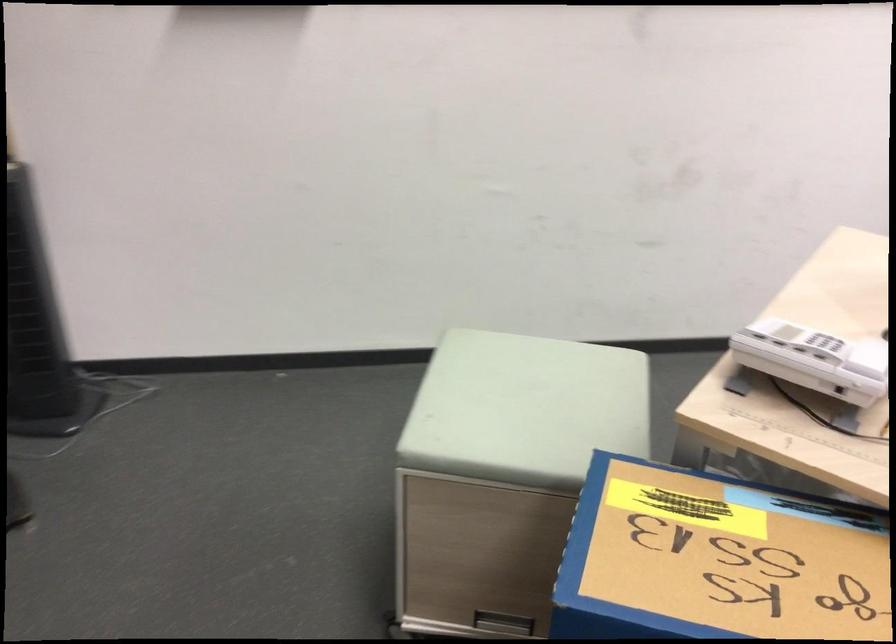
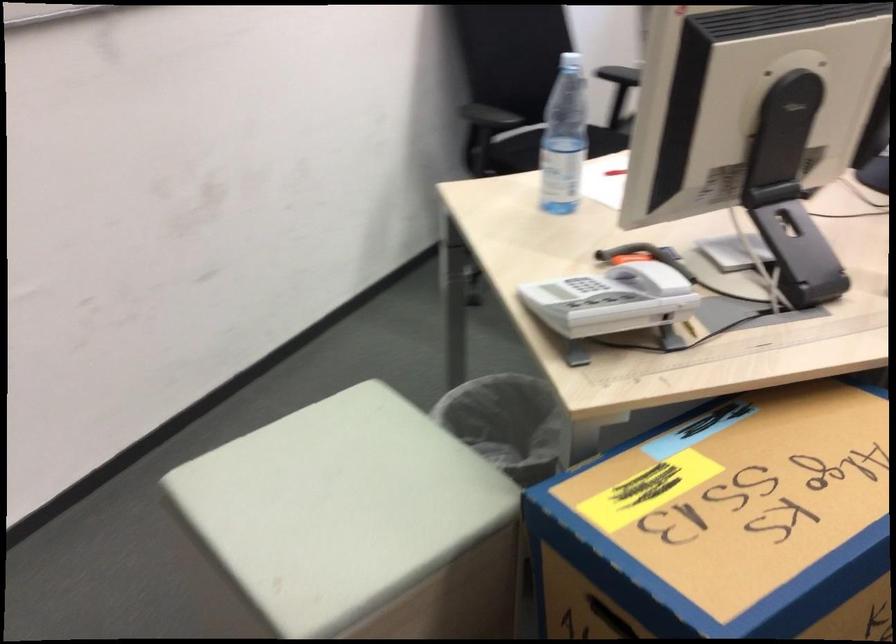
Question: The camera is either moving clockwise (left) or counter-clockwise (right) around the object. The first image is from the beginning of the video and the second image is from the end. Is the camera moving left or right when shooting the video?

Choices:
 (A) Left
 (B) Right

Answer: (A)